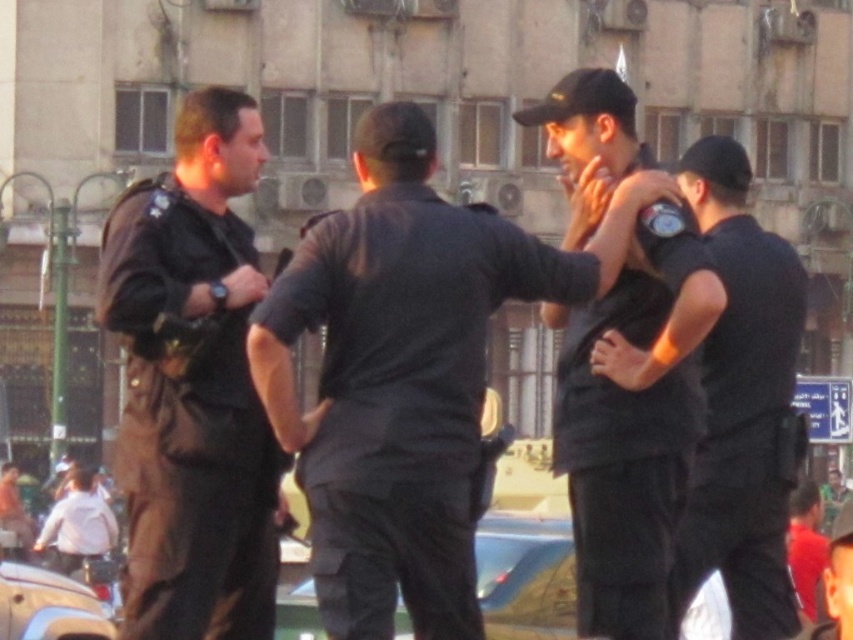
You are a security analyst reviewing a surveillance video. In the image, you see a black matte shirt at center and a black uniform at center. Which object is positioned lower in the scene?

The black matte shirt at center is below the black uniform at center, so the black matte shirt at center is positioned lower in the scene.

You are a bystander observing the scene. Which officer, the dark brown uniform at left or the black uniform at center, is positioned closer to the front of the group?

The dark brown uniform at left is closer to the viewer than the black uniform at center, so the dark brown uniform at left is positioned closer to the front of the group.

You are an observer standing in the street looking at the scene. You notice the dark brown uniform at left and the black uniform at center. Which one is shorter in height?

The dark brown uniform at left has a lesser height compared to the black uniform at center, so the dark brown uniform at left is shorter in height.